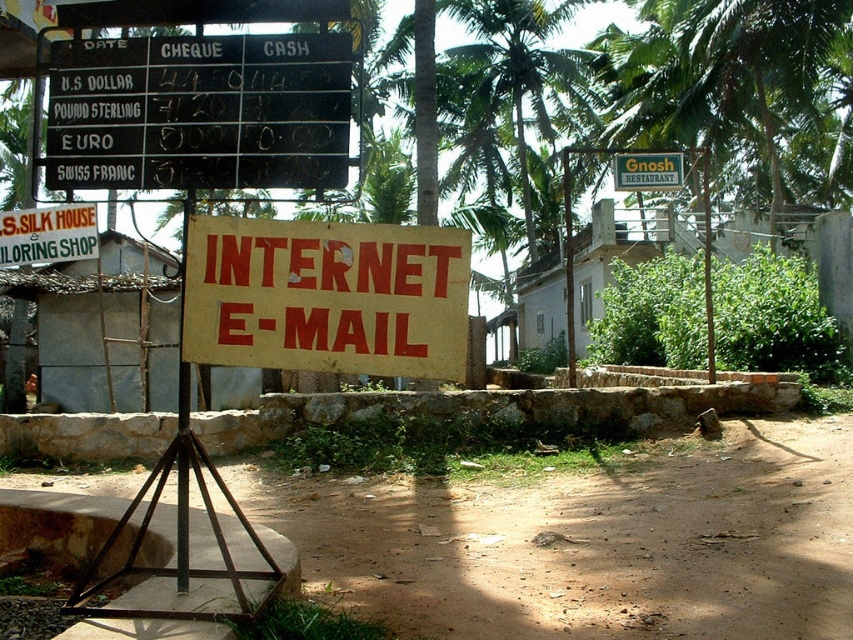
Question: Is yellow/yellowish paper sign at center below green leafy palm tree at upper center?

Choices:
 (A) no
 (B) yes

Answer: (B)

Question: Which of these objects is positioned closest to the brown dirt field at center?

Choices:
 (A) green leafy palm tree at upper center
 (B) yellow paper sign at center
 (C) gray corrugated metal hut at left
 (D) white concrete hut at center

Answer: (B)

Question: Observing the image, what is the correct spatial positioning of black plastic board at upper left in reference to white concrete hut at center?

Choices:
 (A) below
 (B) above

Answer: (A)

Question: Where is yellow/yellowish paper sign at center located in relation to green leafy palm tree at upper center in the image?

Choices:
 (A) above
 (B) below

Answer: (B)

Question: Which point is closer to the camera?

Choices:
 (A) green plastic signboard at upper center
 (B) yellow wood pole at center

Answer: (B)

Question: Which point is closer to the camera taking this photo?

Choices:
 (A) (459, 307)
 (B) (497, 19)

Answer: (A)